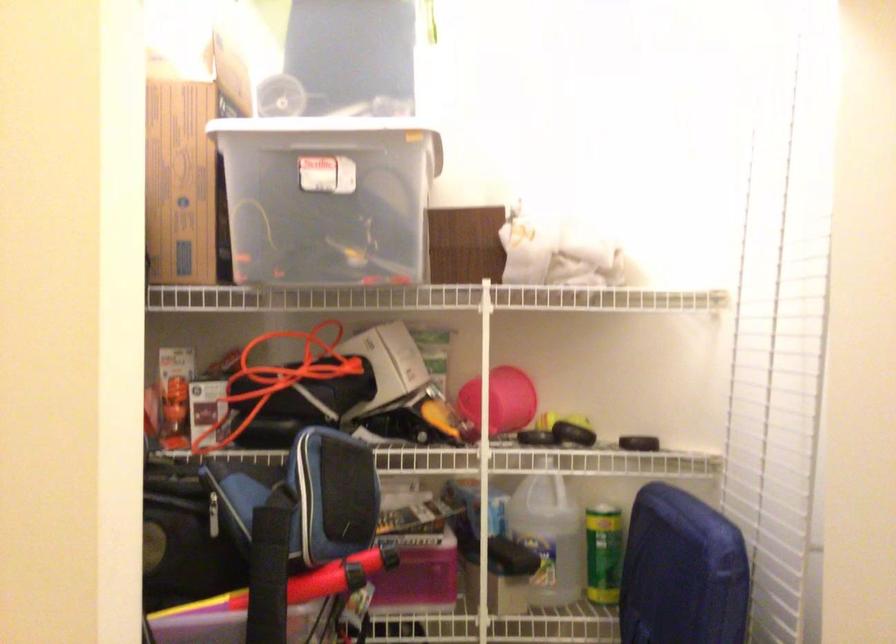
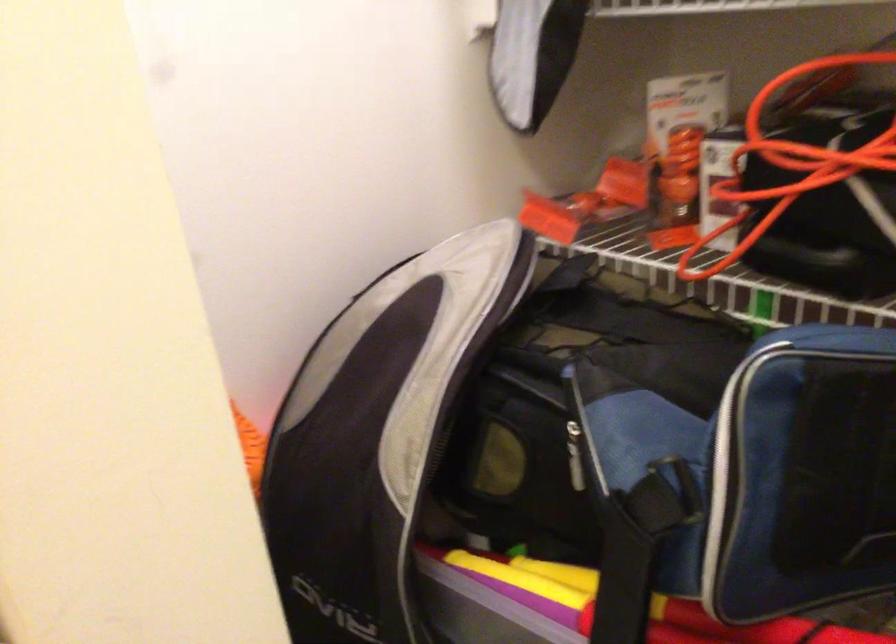
In the second image, find the point that corresponds to pixel 271 542 in the first image.

(622, 581)